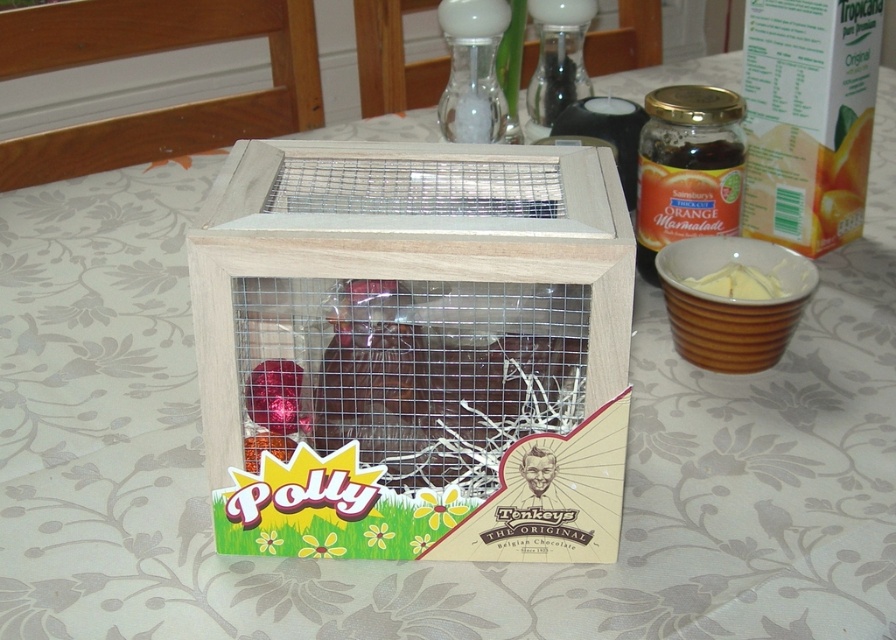
Can you confirm if wooden wire mesh bird cage at center is wider than shiny chocolate bar at center?

Indeed, wooden wire mesh bird cage at center has a greater width compared to shiny chocolate bar at center.

In the scene shown: Who is more forward, (610, 534) or (322, 289)?

Point (610, 534) is more forward.

Where is `wooden wire mesh bird cage at center`? wooden wire mesh bird cage at center is located at coordinates (414, 349).

Who is more forward, (490, 477) or (729, 285)?

Point (490, 477)

Does wooden wire mesh bird cage at center have a smaller size compared to yellow creamy butter at center?

Actually, wooden wire mesh bird cage at center might be larger than yellow creamy butter at center.

Identify the location of wooden wire mesh bird cage at center. (414, 349).

Where is `shiny chocolate bar at center`? This screenshot has height=640, width=896. shiny chocolate bar at center is located at coordinates (409, 371).

Between shiny chocolate bar at center and yellow creamy butter at center, which one is positioned higher?

Positioned higher is yellow creamy butter at center.

Where is `shiny chocolate bar at center`? shiny chocolate bar at center is located at coordinates (409, 371).

Identify the location of shiny chocolate bar at center. (409, 371).